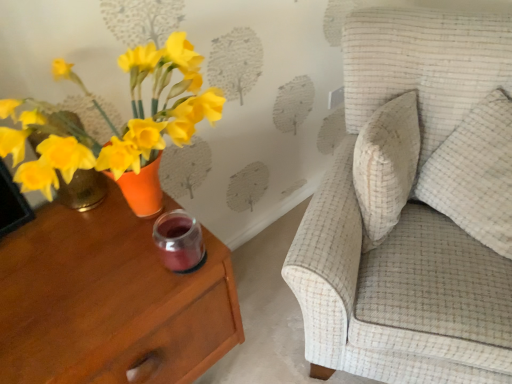
Question: Is textured beige sofa at upper right at the left side of white textured pillow at right?

Choices:
 (A) yes
 (B) no

Answer: (A)

Question: From a real-world perspective, is textured beige sofa at upper right on white textured pillow at right?

Choices:
 (A) yes
 (B) no

Answer: (B)

Question: Is textured beige sofa at upper right positioned far away from white textured pillow at right?

Choices:
 (A) yes
 (B) no

Answer: (B)

Question: From the image's perspective, is textured beige sofa at upper right on white textured pillow at right?

Choices:
 (A) no
 (B) yes

Answer: (A)

Question: Is the depth of textured beige sofa at upper right greater than that of white textured pillow at right?

Choices:
 (A) yes
 (B) no

Answer: (B)

Question: From a real-world perspective, is matte wood nightstand at left physically located above or below textured beige sofa at upper right?

Choices:
 (A) below
 (B) above

Answer: (A)

Question: Looking at the image, does matte wood nightstand at left seem bigger or smaller compared to textured beige sofa at upper right?

Choices:
 (A) small
 (B) big

Answer: (A)

Question: Considering the positions of matte wood nightstand at left and textured beige sofa at upper right in the image, is matte wood nightstand at left wider or thinner than textured beige sofa at upper right?

Choices:
 (A) thin
 (B) wide

Answer: (A)

Question: Is matte wood nightstand at left inside or outside of textured beige sofa at upper right?

Choices:
 (A) outside
 (B) inside

Answer: (A)

Question: From the image's perspective, is textured beige sofa at upper right positioned above or below white textured pillow at right?

Choices:
 (A) below
 (B) above

Answer: (A)

Question: Is textured beige sofa at upper right taller or shorter than white textured pillow at right?

Choices:
 (A) tall
 (B) short

Answer: (A)

Question: Considering the positions of point (364, 248) and point (495, 99), is point (364, 248) closer or farther from the camera than point (495, 99)?

Choices:
 (A) farther
 (B) closer

Answer: (B)

Question: In terms of width, does textured beige sofa at upper right look wider or thinner when compared to white textured pillow at right?

Choices:
 (A) wide
 (B) thin

Answer: (A)

Question: Is point click(x=12, y=248) closer or farther from the camera than point click(x=472, y=165)?

Choices:
 (A) farther
 (B) closer

Answer: (B)

Question: Choose the correct answer: Is matte wood nightstand at left inside white textured pillow at right or outside it?

Choices:
 (A) inside
 (B) outside

Answer: (B)